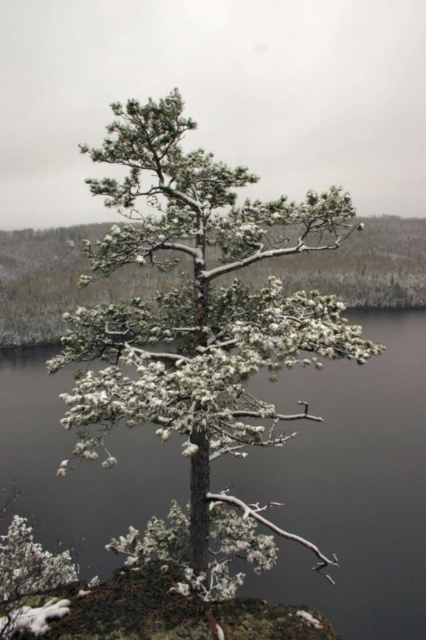
You are standing in front of the pine tree and want to determine the relative positions of two points marked in the image. Which point is nearer to you, point 1 at coordinates (92, 404) or point 2 at coordinates (271, 452)?

Point 1 at coordinates (92, 404) is closer to the viewer than point 2 at coordinates (271, 452).